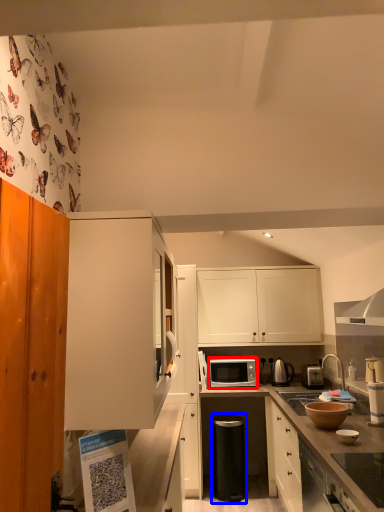
Question: Which of the following is the closest to the observer, microwave oven (highlighted by a red box) or appliance (highlighted by a blue box)?

Choices:
 (A) microwave oven
 (B) appliance

Answer: (B)